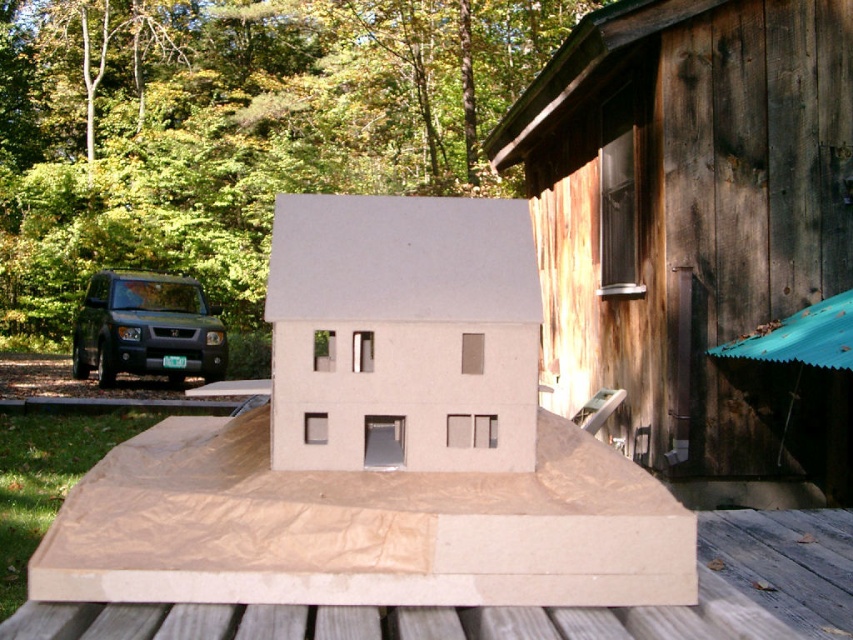
You are standing at the center of the image. Which direction should you look to see the weathered wood hut at right?

You should look to the right to see the weathered wood hut at right since it is located at the right side of the image.

You are standing at the center of the image. Which object is positioned higher relative to the other between the weathered wood hut at right and the dark green matte suv at left?

The weathered wood hut at right is located above the dark green matte suv at left, so it is positioned higher.

You are planning to move the white cardboard cabin at center and the dark green matte suv at left to a new location. If you need to fit both items through a doorway that is 1.2 meters wide, which item will definitely fit through the doorway without rotating it?

The white cardboard cabin at center has a lesser width compared to the dark green matte suv at left. Since the doorway is 1.2 meters wide, the white cardboard cabin at center will definitely fit through the doorway without rotating it, but the dark green matte suv at left might not fit if its width exceeds 1.2 meters.